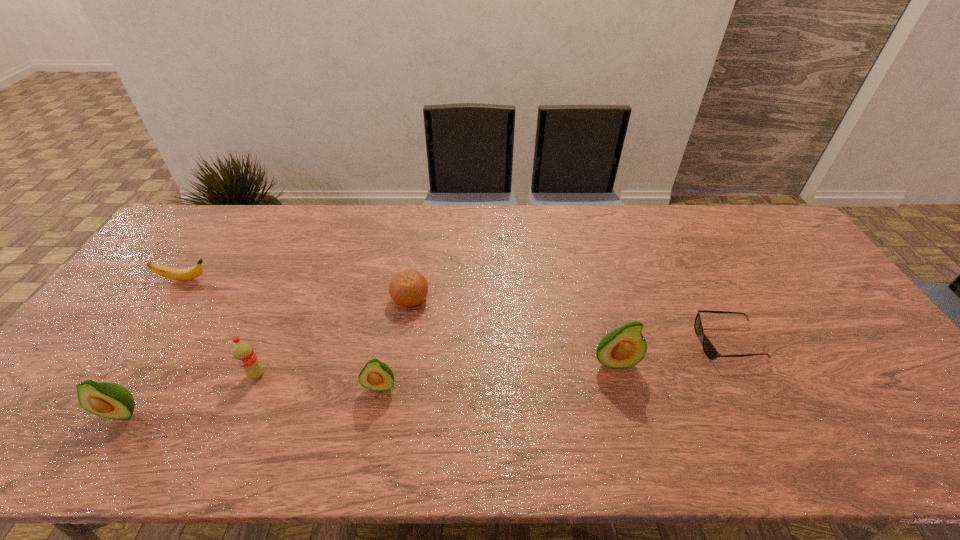
Where is `vacant area that lies between the shortest avocado and the rightmost avocado`? vacant area that lies between the shortest avocado and the rightmost avocado is located at coordinates (497, 374).

Identify the location of free spot between the banana and the farthest avocado. (399, 321).

Locate an element on the screen. free space between the sixth nearest object and the sunglasses is located at coordinates (569, 321).

You are a GUI agent. You are given a task and a screenshot of the screen. Output one action in this format:
    pyautogui.click(x=<x>, y=<y>)
    Task: Click on the empty space between the fifth object from right to left and the farthest avocado
    The height and width of the screenshot is (540, 960).
    Given the screenshot: What is the action you would take?
    pyautogui.click(x=436, y=368)

The height and width of the screenshot is (540, 960). I want to click on vacant region between the banana and the shortest object, so (x=457, y=311).

Point out which object is positioned as the third nearest to the shortest avocado. Please provide its 2D coordinates. Your answer should be formatted as a tuple, i.e. [(x, y)], where the tuple contains the x and y coordinates of a point satisfying the conditions above.

[(624, 347)]

This screenshot has width=960, height=540. What are the coordinates of `the fourth closest object to the banana` in the screenshot? It's located at (377, 376).

Choose which avocado is the third nearest neighbor to the banana. Please provide its 2D coordinates. Your answer should be formatted as a tuple, i.e. [(x, y)], where the tuple contains the x and y coordinates of a point satisfying the conditions above.

[(624, 347)]

Select which avocado is the closest to the second farthest avocado. Please provide its 2D coordinates. Your answer should be formatted as a tuple, i.e. [(x, y)], where the tuple contains the x and y coordinates of a point satisfying the conditions above.

[(624, 347)]

You are a GUI agent. You are given a task and a screenshot of the screen. Output one action in this format:
    pyautogui.click(x=<x>, y=<y>)
    Task: Click on the free space in the image that satisfies the following two spatial constraints: 1. on the lenses of the sunglasses; 2. on the cut side of the leftmost avocado
    This screenshot has width=960, height=540.
    Given the screenshot: What is the action you would take?
    pyautogui.click(x=763, y=412)